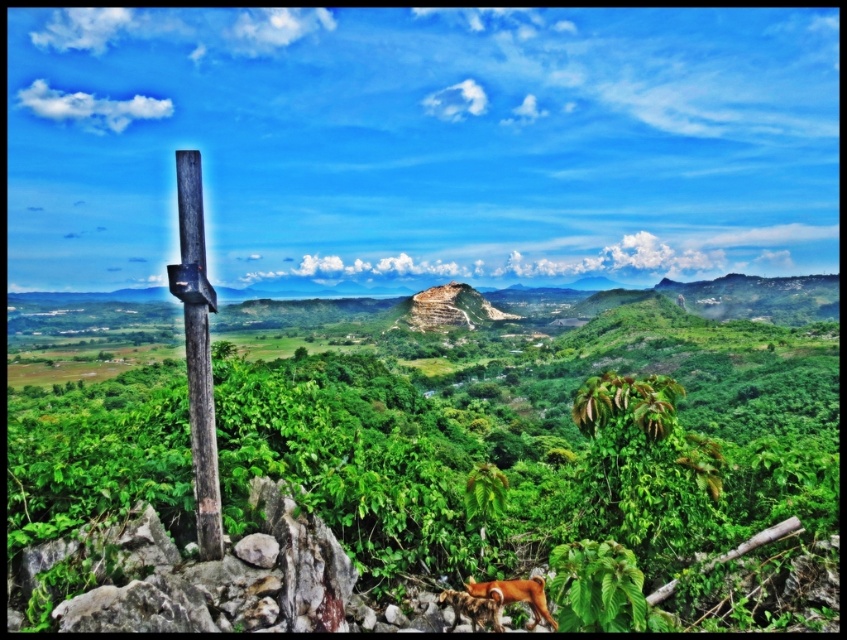
You are standing at the center of the rocky terrain in the foreground. You want to walk to the wooden cross on the left side. Which direction should you walk to avoid the green leafy vegetation at center?

You should walk to the left to avoid the green leafy vegetation at center, as the wooden cross is on the left side of the frame and the vegetation is at the center.